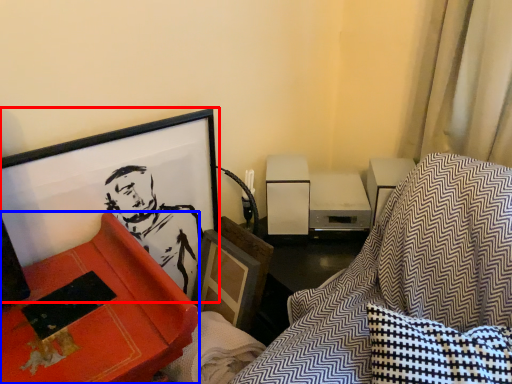
Question: Among these objects, which one is nearest to the camera, picture frame (highlighted by a red box) or furniture (highlighted by a blue box)?

Choices:
 (A) picture frame
 (B) furniture

Answer: (B)